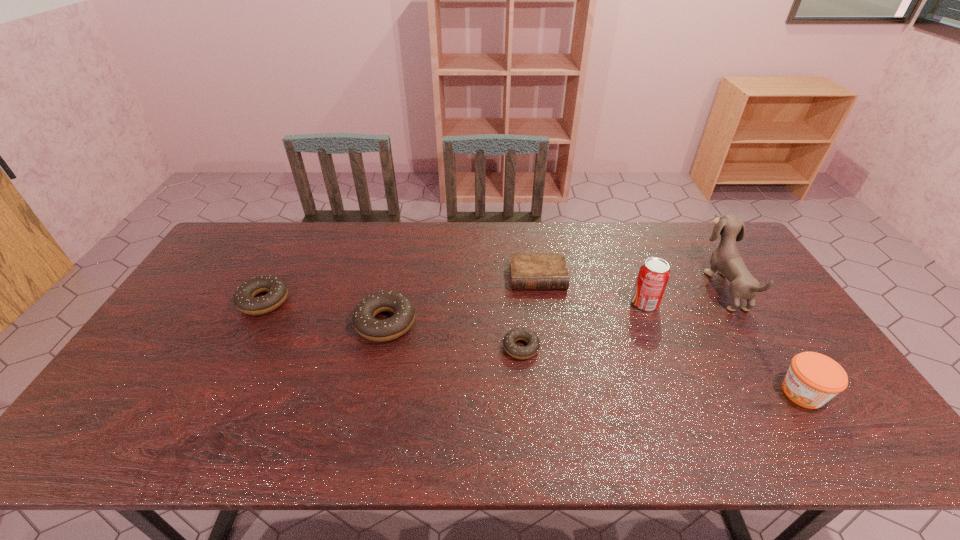
Find the location of a particular element. the nearest object is located at coordinates (813, 379).

The height and width of the screenshot is (540, 960). Find the location of `blank area located 0.150m on the back of the leftmost doughnut`. blank area located 0.150m on the back of the leftmost doughnut is located at coordinates click(288, 255).

The image size is (960, 540). I want to click on free space located on the left of the second doughnut from right to left, so click(318, 323).

This screenshot has height=540, width=960. What are the coordinates of `vacant position located 0.120m on the left of the rightmost doughnut` in the screenshot? It's located at (459, 347).

Where is `blank space located 0.350m on the spine side of the diary`? Image resolution: width=960 pixels, height=540 pixels. blank space located 0.350m on the spine side of the diary is located at coordinates (554, 386).

Locate an element on the screen. vacant region located at the face of the tallest object is located at coordinates (686, 286).

You are a GUI agent. You are given a task and a screenshot of the screen. Output one action in this format:
    pyautogui.click(x=<x>, y=<y>)
    Task: Click on the free spot located 0.270m at the face of the tallest object
    The height and width of the screenshot is (540, 960).
    Given the screenshot: What is the action you would take?
    pyautogui.click(x=624, y=286)

Image resolution: width=960 pixels, height=540 pixels. Find the location of `free space located at the face of the tallest object`. free space located at the face of the tallest object is located at coordinates (639, 286).

Locate an element on the screen. vacant space located on the front of the soda can is located at coordinates (683, 397).

Find the location of a particular element. The height and width of the screenshot is (540, 960). free region located on the front label of the third tallest object is located at coordinates coord(631,393).